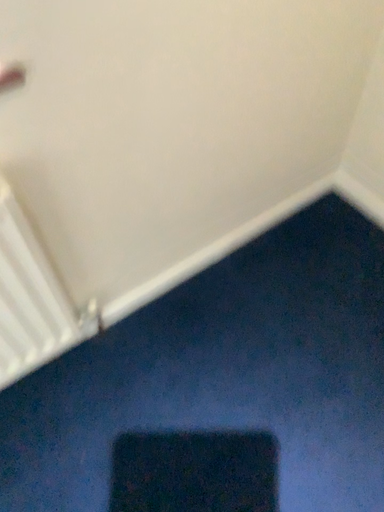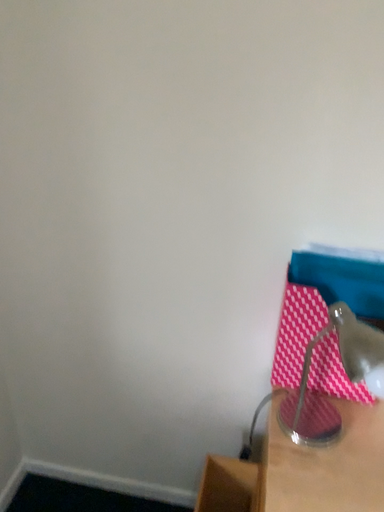
Question: How did the camera likely rotate when shooting the video?

Choices:
 (A) rotated right
 (B) rotated left

Answer: (A)